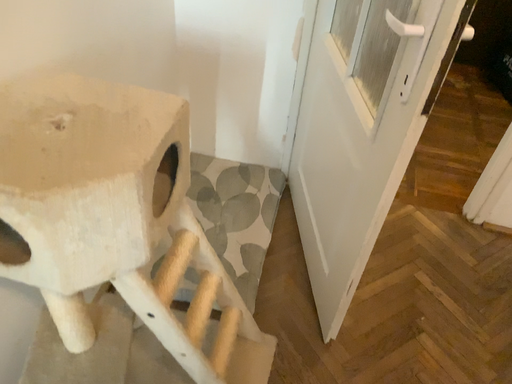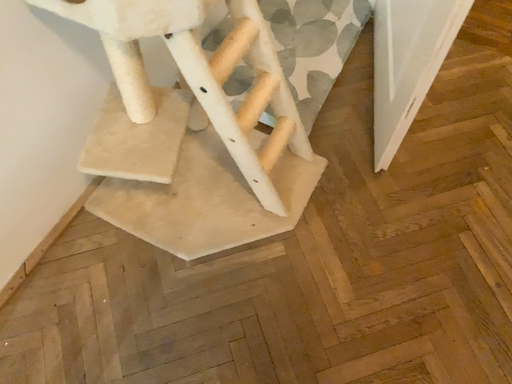
Question: How did the camera likely rotate when shooting the video?

Choices:
 (A) rotated downward
 (B) rotated upward

Answer: (A)